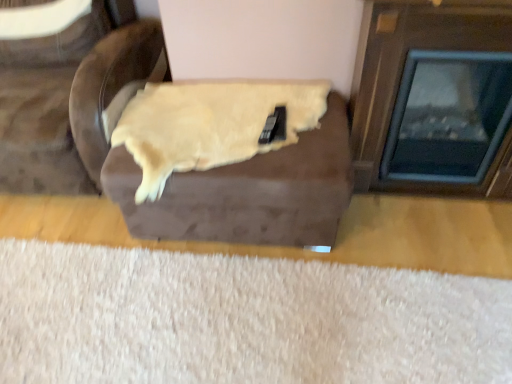
This screenshot has height=384, width=512. I want to click on blank area beneath white fluffy rug at lower center (from a real-world perspective), so click(244, 328).